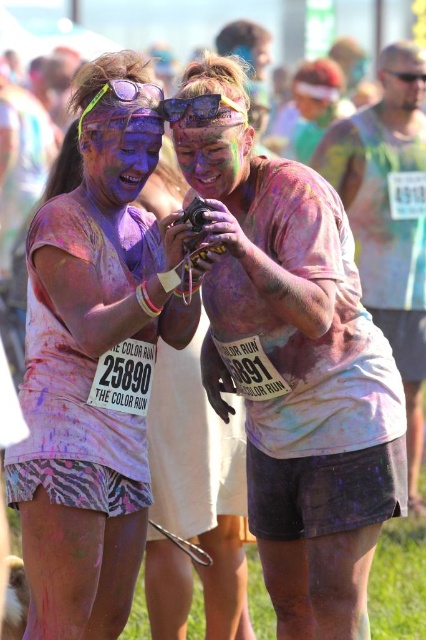
Which is below, matte pink shirt at center or purple matte face at center?

matte pink shirt at center

Describe the element at coordinates (304, 394) in the screenshot. The height and width of the screenshot is (640, 426). I see `matte pink shirt at center` at that location.

Identify the location of matte pink shirt at center. (304, 394).

Is matte purple face paint at center above multicolored paint face at center?

Actually, matte purple face paint at center is below multicolored paint face at center.

Which is in front, point (100, 320) or point (215, 180)?

Point (100, 320)

Between point (74, 412) and point (207, 125), which one is positioned behind?

Point (74, 412)

Find the location of a particular element. This screenshot has width=426, height=640. matte purple face paint at center is located at coordinates (94, 378).

Who is lower down, matte purple face paint at center or purple matte face at center?

matte purple face paint at center is lower down.

The height and width of the screenshot is (640, 426). Describe the element at coordinates (94, 378) in the screenshot. I see `matte purple face paint at center` at that location.

Identify the location of matte purple face paint at center. The image size is (426, 640). point(94,378).